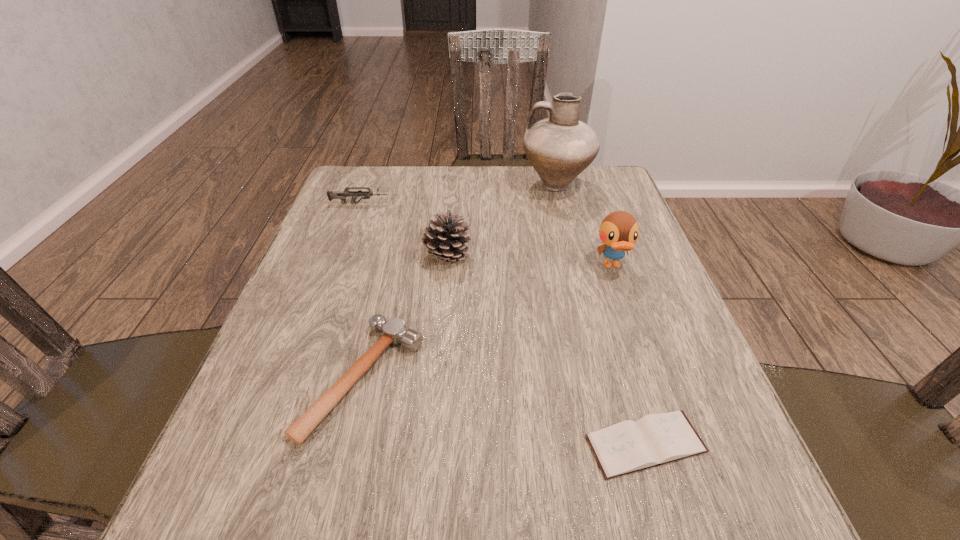
Locate an element on the screen. This screenshot has width=960, height=540. empty location between the hammer and the shortest object is located at coordinates (505, 411).

What are the coordinates of `object that is the fourth closest to the pinecone` in the screenshot? It's located at (619, 231).

Identify the location of object that is the nearest to the second shortest object. (444, 237).

Where is `vacant point that satisfies the following two spatial constraints: 1. aimed along the barrel of the fourth tallest object; 2. on the back side of the fifth tallest object`? This screenshot has height=540, width=960. vacant point that satisfies the following two spatial constraints: 1. aimed along the barrel of the fourth tallest object; 2. on the back side of the fifth tallest object is located at coordinates (295, 377).

Identify the location of vacant position in the image that satisfies the following two spatial constraints: 1. on the back side of the diary; 2. on the handle side of the pitcher. The height and width of the screenshot is (540, 960). (569, 185).

The image size is (960, 540). In order to click on vacant region that satisfies the following two spatial constraints: 1. on the handle side of the diary; 2. on the right side of the tallest object in this screenshot , I will do `click(620, 444)`.

Where is `free space that satisfies the following two spatial constraints: 1. aimed along the barrel of the diary; 2. on the left side of the gun`? This screenshot has height=540, width=960. free space that satisfies the following two spatial constraints: 1. aimed along the barrel of the diary; 2. on the left side of the gun is located at coordinates click(270, 444).

The height and width of the screenshot is (540, 960). Find the location of `free space that satisfies the following two spatial constraints: 1. aimed along the barrel of the gun; 2. on the back side of the shortest object`. free space that satisfies the following two spatial constraints: 1. aimed along the barrel of the gun; 2. on the back side of the shortest object is located at coordinates (x=270, y=444).